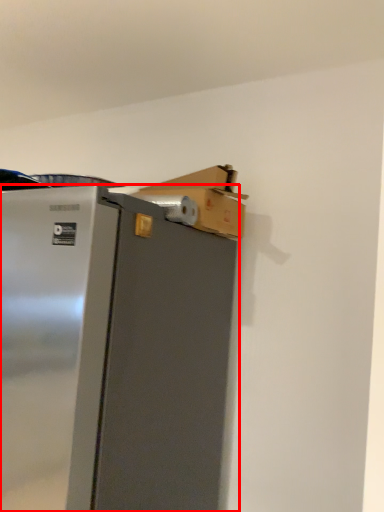
Question: Observing the image, what is the correct spatial positioning of refrigerator (annotated by the red box) in reference to cardboard box?

Choices:
 (A) left
 (B) right

Answer: (A)